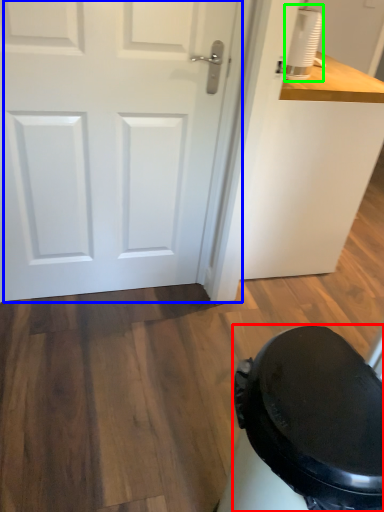
Question: Which is nearer to the potty (highlighted by a red box)? door (highlighted by a blue box) or appliance (highlighted by a green box).

Choices:
 (A) door
 (B) appliance

Answer: (A)